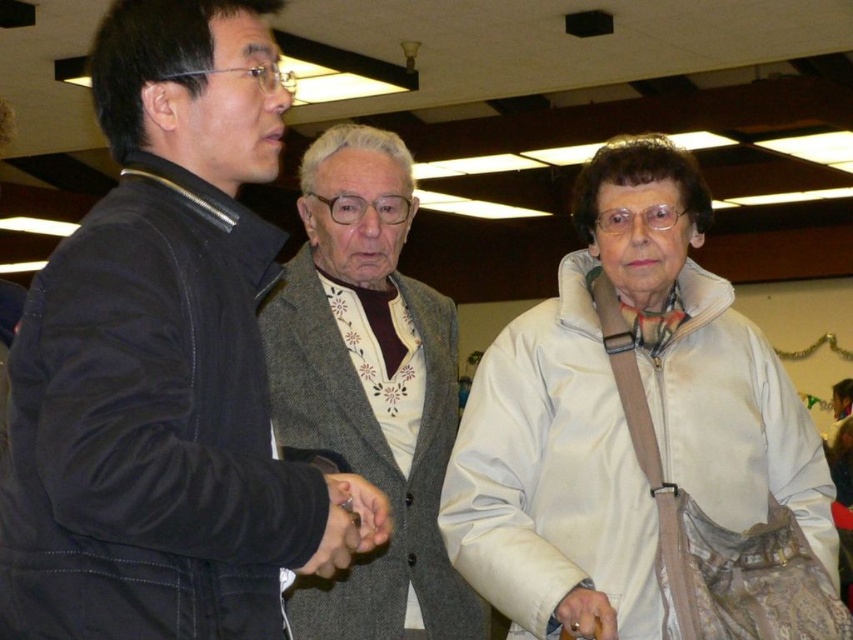
Question: Among these points, which one is nearest to the camera?

Choices:
 (A) (405, 531)
 (B) (143, 1)

Answer: (B)

Question: Does white fabric jacket at center have a lesser width compared to gray wool sweater at center?

Choices:
 (A) no
 (B) yes

Answer: (A)

Question: Can you confirm if black leather jacket at left is positioned to the left of white fabric jacket at center?

Choices:
 (A) yes
 (B) no

Answer: (A)

Question: Can you confirm if white fabric jacket at center is positioned below gray wool sweater at center?

Choices:
 (A) yes
 (B) no

Answer: (A)

Question: Estimate the real-world distances between objects in this image. Which object is closer to the gray wool sweater at center?

Choices:
 (A) white fabric jacket at center
 (B) black leather jacket at left

Answer: (A)

Question: Which point is closer to the camera?

Choices:
 (A) (49, 259)
 (B) (397, 141)

Answer: (A)